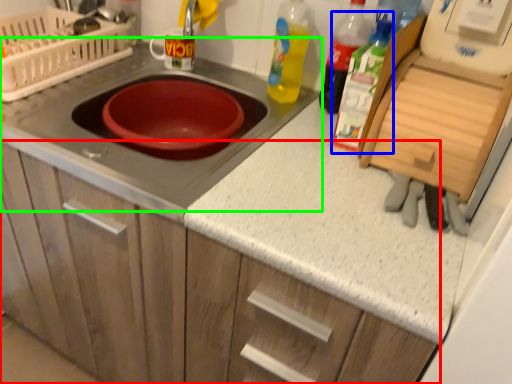
Question: Estimate the real-world distances between objects in this image. Which object is closer to cabinetry (highlighted by a red box), bottle (highlighted by a blue box) or gas stove (highlighted by a green box)?

Choices:
 (A) bottle
 (B) gas stove

Answer: (B)